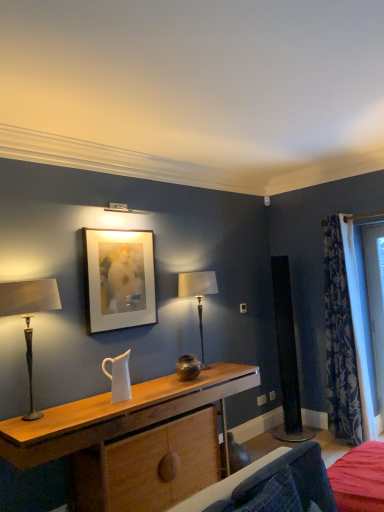
The width and height of the screenshot is (384, 512). In order to click on vacant location below matte bronze table lamp at left, arranged as the first table lamp when viewed from the front (from a real-world perspective) in this screenshot , I will do `click(33, 419)`.